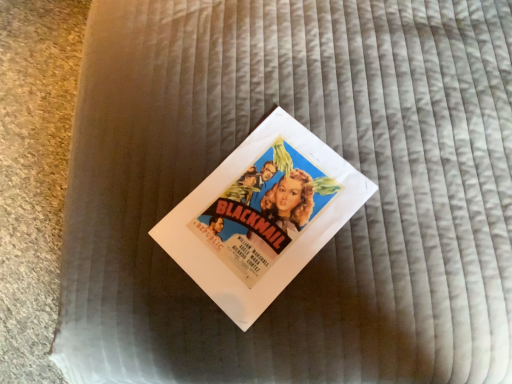
Identify the location of matte paper poster at center. This screenshot has width=512, height=384. [262, 216].

Image resolution: width=512 pixels, height=384 pixels. What do you see at coordinates (262, 216) in the screenshot?
I see `matte paper poster at center` at bounding box center [262, 216].

What is the approximate width of matte paper poster at center?

matte paper poster at center is 12.44 inches wide.

Find the location of a particular element. This screenshot has height=384, width=512. matte paper poster at center is located at coordinates (262, 216).